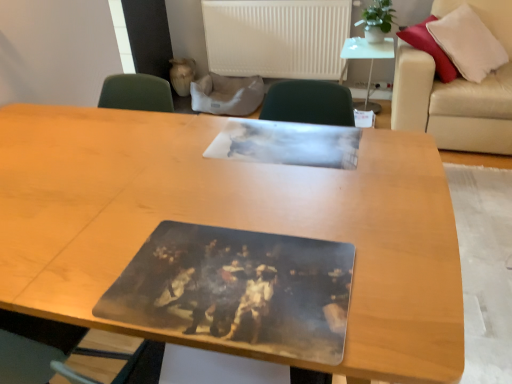
Question: Considering the positions of beige leather couch at right and wooden table at center, arranged as the 1th table when viewed from the front, in the image, is beige leather couch at right wider or thinner than wooden table at center, arranged as the 1th table when viewed from the front,?

Choices:
 (A) wide
 (B) thin

Answer: (A)

Question: Considering the positions of beige leather couch at right and wooden table at center, the second table positioned from the top, in the image, is beige leather couch at right taller or shorter than wooden table at center, the second table positioned from the top,?

Choices:
 (A) tall
 (B) short

Answer: (A)

Question: Which of these objects is positioned closest to the wooden table at center, the second table positioned from the front?

Choices:
 (A) beige leather couch at right
 (B) wooden table at center, marked as the 2th table in a back-to-front arrangement
 (C) white matte radiator at upper center

Answer: (C)

Question: Which object is the closest to the wooden table at center, the second table positioned from the top?

Choices:
 (A) white matte radiator at upper center
 (B) wooden table at center, the first table from the back
 (C) beige leather couch at right

Answer: (C)